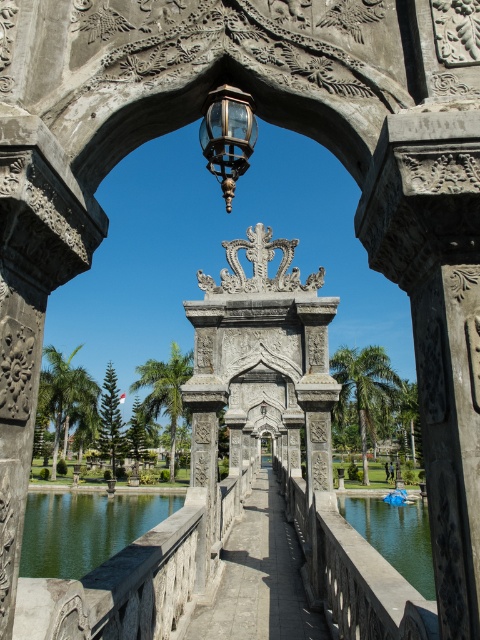
You are a gardener who needs to place a new decorative statue that is 1.2 meters wide between the green liquid water at bridge center and the matte glass lantern at center. Based on the scene, can the statue fit between them without overlapping either object?

The green liquid water at bridge center is wider than the matte glass lantern at center. Since the statue is 1.2 meters wide, it depends on the actual space between them. However, the description only states the width comparison between the two objects, not the distance between them. Therefore, we cannot determine if the statue will fit without more information about the spacing between the objects.

You are a visitor walking along the pathway under the archway. You see the green reflective water at lower left and the green liquid water at bridge center. Which one is bigger in size?

The green reflective water at lower left is larger in size than the green liquid water at bridge center.

You are standing at the entrance of the garden and want to cross the bridge to the other side. You see the green reflective water at lower left and the green liquid water at bridge center. Which water is closer to you as you approach the bridge?

The green reflective water at lower left is closer to the viewer than the green liquid water at bridge center, so the green reflective water at lower left is closer to you as you approach the bridge.